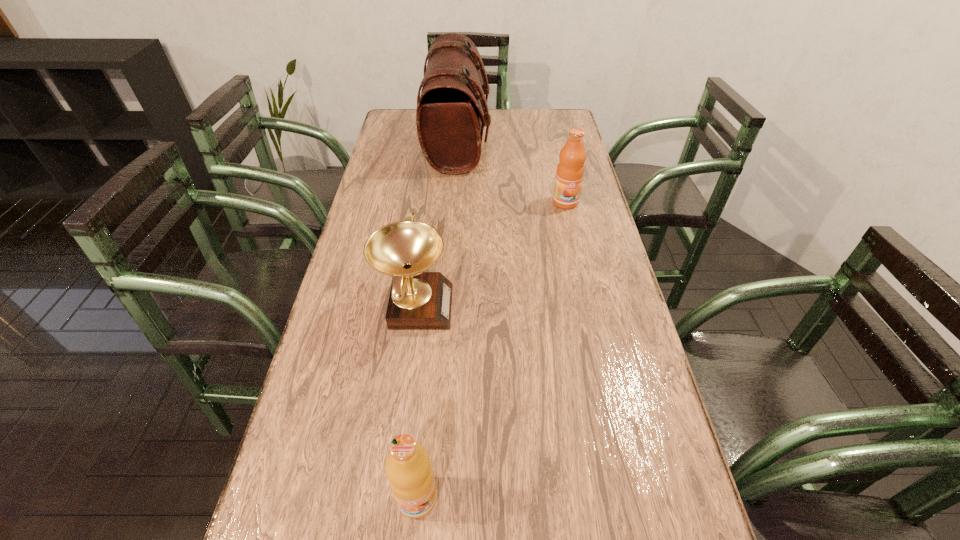
This screenshot has height=540, width=960. I want to click on free space between the farthest object and the third farthest object, so click(437, 224).

At what (x,y) coordinates should I click in order to perform the action: click on empty space between the rightmost object and the third farthest object. Please return your answer as a coordinate pair (x, y). This screenshot has height=540, width=960. Looking at the image, I should click on (491, 253).

The height and width of the screenshot is (540, 960). In order to click on empty space between the right fruit juice and the farthest object in this screenshot , I will do `click(512, 172)`.

In order to click on free spot between the third nearest object and the third farthest object in this screenshot , I will do `click(491, 253)`.

This screenshot has height=540, width=960. In order to click on free spot between the satchel and the farther fruit juice in this screenshot , I will do `click(512, 172)`.

The width and height of the screenshot is (960, 540). Identify the location of unoccupied position between the award and the nearest object. (416, 401).

The width and height of the screenshot is (960, 540). Identify the location of object that is the third nearest to the nearest object. (450, 122).

Locate which object ranks third in proximity to the third nearest object. Please provide its 2D coordinates. Your answer should be formatted as a tuple, i.e. [(x, y)], where the tuple contains the x and y coordinates of a point satisfying the conditions above.

[(408, 468)]

The height and width of the screenshot is (540, 960). Identify the location of vacant position in the image that satisfies the following two spatial constraints: 1. on the front-facing side of the satchel; 2. on the front label of the nearer fruit juice. (433, 498).

Locate an element on the screen. blank space that satisfies the following two spatial constraints: 1. on the front-facing side of the satchel; 2. on the front label of the nearer fruit juice is located at coordinates (433, 498).